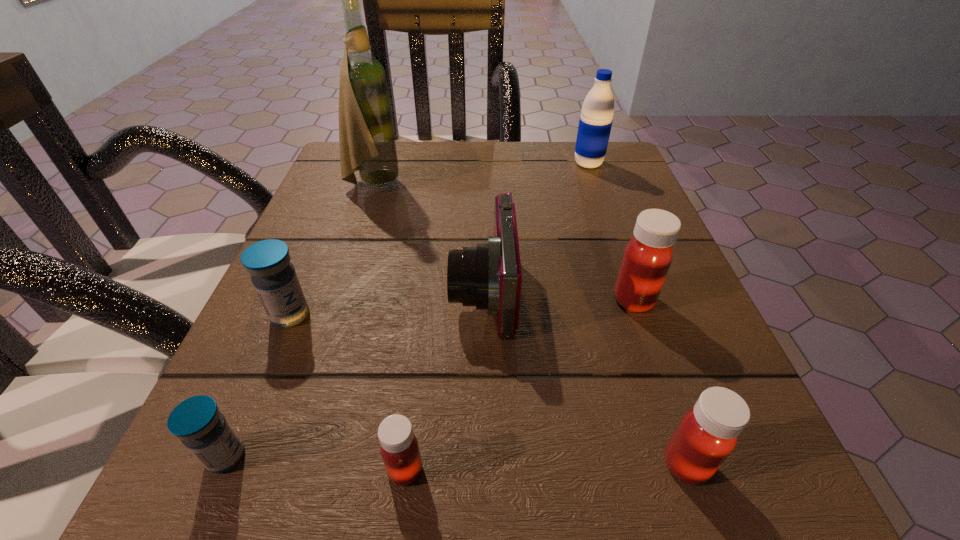
This screenshot has width=960, height=540. I want to click on wine bottle, so click(367, 144).

This screenshot has width=960, height=540. Identify the location of water bottle. coord(595,122).

Where is `the seventh shortest object`? The width and height of the screenshot is (960, 540). the seventh shortest object is located at coordinates (595, 122).

The image size is (960, 540). I want to click on the farthest red medicine, so click(648, 255).

Find the location of a particular element. The width and height of the screenshot is (960, 540). the tallest medicine is located at coordinates (648, 255).

Locate an element on the screen. The image size is (960, 540). camera is located at coordinates (489, 276).

Find the location of `the farther blue medicine`. the farther blue medicine is located at coordinates (273, 276).

Locate an element on the screen. the second smallest red medicine is located at coordinates (707, 434).

Where is `the fourth object from left to right`? The image size is (960, 540). the fourth object from left to right is located at coordinates (399, 448).

Find the location of `the third medicine from right to left`. the third medicine from right to left is located at coordinates (399, 448).